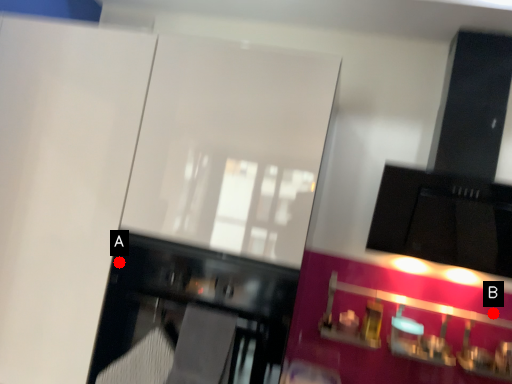
Question: Two points are circled on the image, labeled by A and B beside each circle. Among these points, which one is nearest to the camera?

Choices:
 (A) A is closer
 (B) B is closer

Answer: (A)